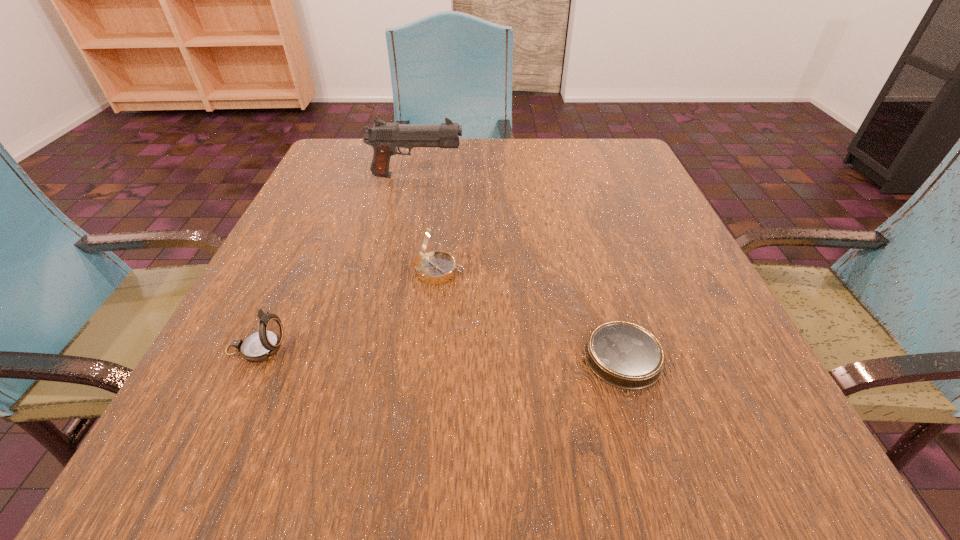
The image size is (960, 540). I want to click on free space at the near right corner of the desktop, so click(x=724, y=445).

Where is `free spot between the farthest object and the shortest object`? This screenshot has width=960, height=540. free spot between the farthest object and the shortest object is located at coordinates (519, 267).

This screenshot has height=540, width=960. What are the coordinates of `free point between the rightmost object and the tallest object` in the screenshot? It's located at (519, 267).

Where is `vacant space in between the gun and the rightmost object`? vacant space in between the gun and the rightmost object is located at coordinates (519, 267).

Identify the location of vacant area that lies between the leftmost compass and the farthest compass. (348, 310).

Find the location of a particular element. The width and height of the screenshot is (960, 540). empty space that is in between the farthest compass and the farthest object is located at coordinates (427, 223).

Identify the location of free space between the second compass from left to right and the shortest compass. The height and width of the screenshot is (540, 960). (531, 314).

Find the location of a particular element. free space that is in between the gun and the second compass from right to left is located at coordinates (427, 223).

Locate an element on the screen. empty space between the tallest object and the rightmost compass is located at coordinates (519, 267).

In order to click on vacant space that is in between the leftmost compass and the rightmost object in this screenshot , I will do `click(440, 353)`.